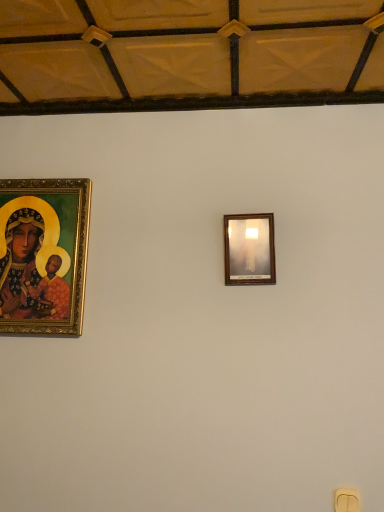
Question: Is gold-framed painting at left to the right of wooden picture frame at upper center from the viewer's perspective?

Choices:
 (A) no
 (B) yes

Answer: (A)

Question: Would you say gold-framed painting at left contains wooden picture frame at upper center?

Choices:
 (A) no
 (B) yes

Answer: (A)

Question: Are gold-framed painting at left and wooden picture frame at upper center making contact?

Choices:
 (A) yes
 (B) no

Answer: (B)

Question: Can you confirm if gold-framed painting at left is taller than wooden picture frame at upper center?

Choices:
 (A) yes
 (B) no

Answer: (A)

Question: From a real-world perspective, is gold-framed painting at left over wooden picture frame at upper center?

Choices:
 (A) no
 (B) yes

Answer: (A)

Question: Is gold-framed painting at left taller or shorter than yellow plastic light switch at lower right?

Choices:
 (A) short
 (B) tall

Answer: (B)

Question: Does point (23, 284) appear closer or farther from the camera than point (354, 501)?

Choices:
 (A) farther
 (B) closer

Answer: (A)

Question: Considering their positions, is gold-framed painting at left located in front of or behind yellow plastic light switch at lower right?

Choices:
 (A) front
 (B) behind

Answer: (B)

Question: Would you say gold-framed painting at left is to the left or to the right of yellow plastic light switch at lower right in the picture?

Choices:
 (A) left
 (B) right

Answer: (A)

Question: In terms of height, does gold-framed painting at left look taller or shorter compared to wooden picture frame at upper center?

Choices:
 (A) tall
 (B) short

Answer: (A)

Question: Does point (49, 300) appear closer or farther from the camera than point (268, 242)?

Choices:
 (A) closer
 (B) farther

Answer: (B)

Question: Would you say gold-framed painting at left is to the left or to the right of wooden picture frame at upper center in the picture?

Choices:
 (A) left
 (B) right

Answer: (A)

Question: Based on their sizes in the image, would you say gold-framed painting at left is bigger or smaller than wooden picture frame at upper center?

Choices:
 (A) small
 (B) big

Answer: (B)

Question: From the image's perspective, is wooden picture frame at upper center located above or below yellow plastic light switch at lower right?

Choices:
 (A) above
 (B) below

Answer: (A)

Question: From a real-world perspective, is wooden picture frame at upper center above or below yellow plastic light switch at lower right?

Choices:
 (A) above
 (B) below

Answer: (A)